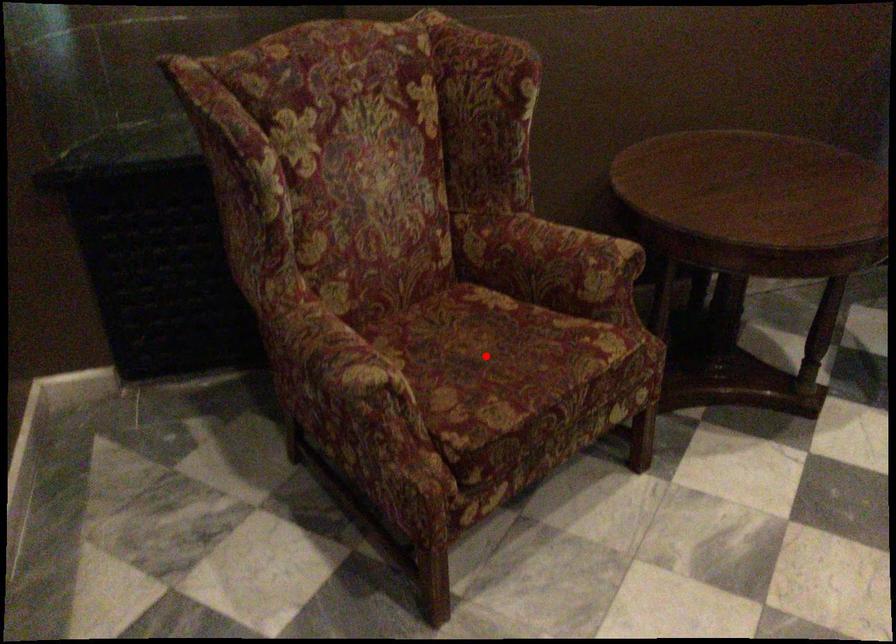
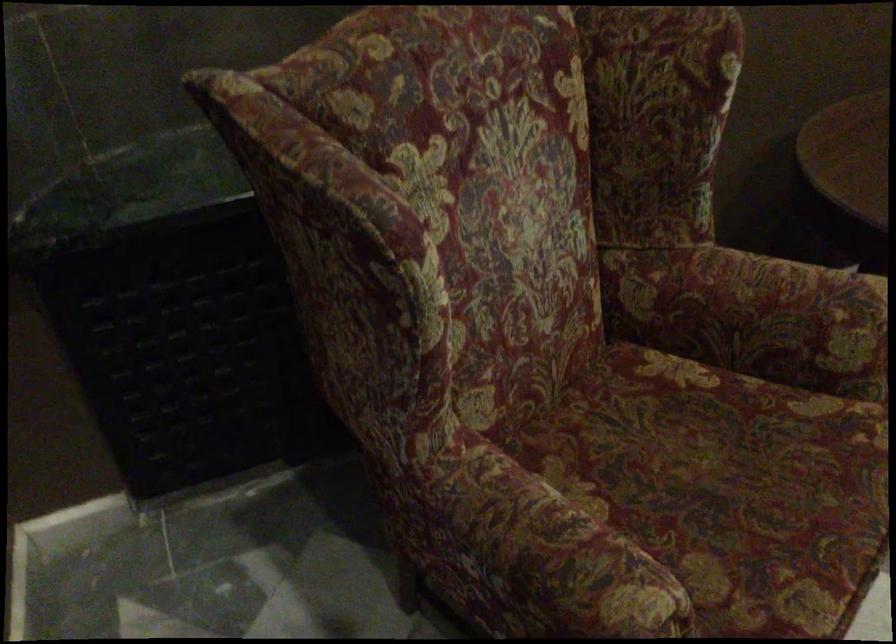
Question: I am providing you with two images of the same scene from different viewpoints. Given a red point in image1, look at the same physical point in image2. Is it:

Choices:
 (A) Closer to the viewpoint
 (B) Farther from the viewpoint

Answer: (A)